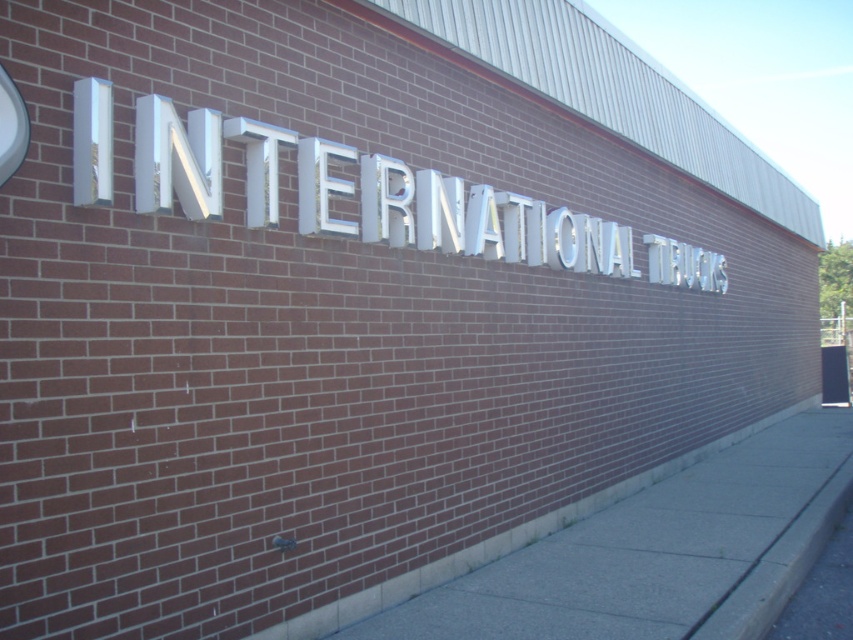
Question: Is gray concrete sidewalk at lower center above white metallic sign at center?

Choices:
 (A) no
 (B) yes

Answer: (A)

Question: Considering the relative positions of gray concrete sidewalk at lower center and white metallic sign at center in the image provided, where is gray concrete sidewalk at lower center located with respect to white metallic sign at center?

Choices:
 (A) above
 (B) below

Answer: (B)

Question: Does gray concrete sidewalk at lower center appear on the right side of white metallic sign at center?

Choices:
 (A) yes
 (B) no

Answer: (A)

Question: Among these objects, which one is farthest from the camera?

Choices:
 (A) gray concrete sidewalk at lower center
 (B) white metallic sign at center

Answer: (A)

Question: Which point appears farthest from the camera in this image?

Choices:
 (A) click(752, 557)
 (B) click(582, 260)

Answer: (B)